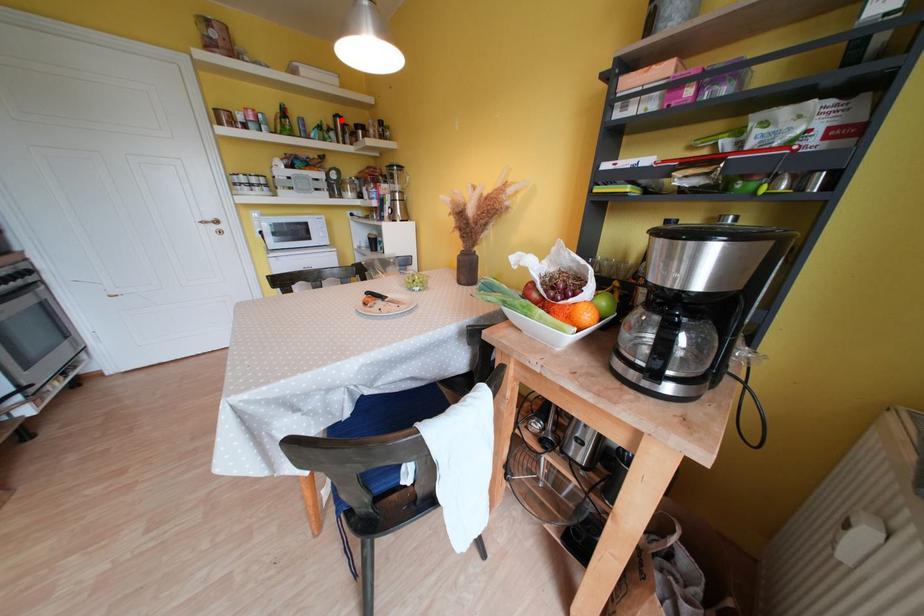
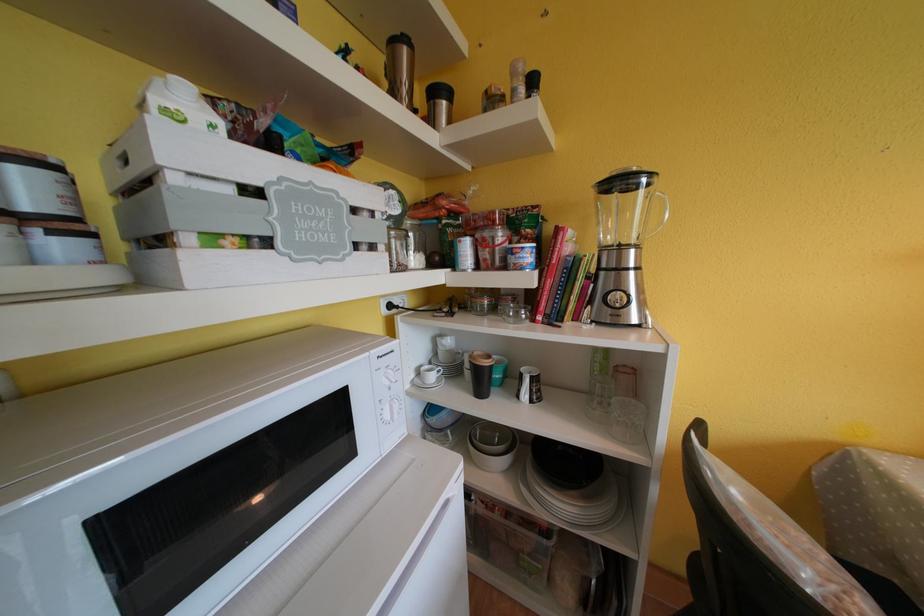
In the second image, find the point that corresponds to the highlighted location in the first image.

(399, 46)